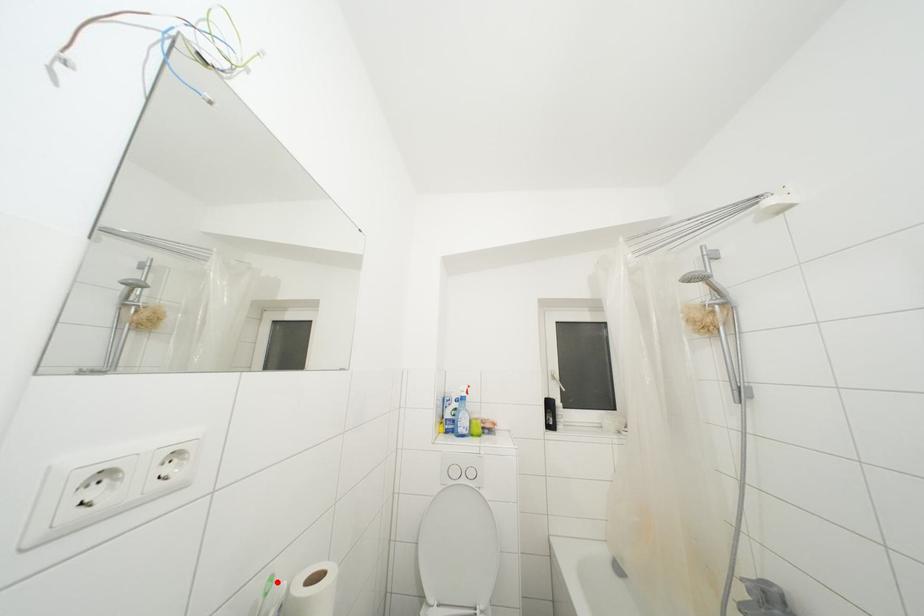
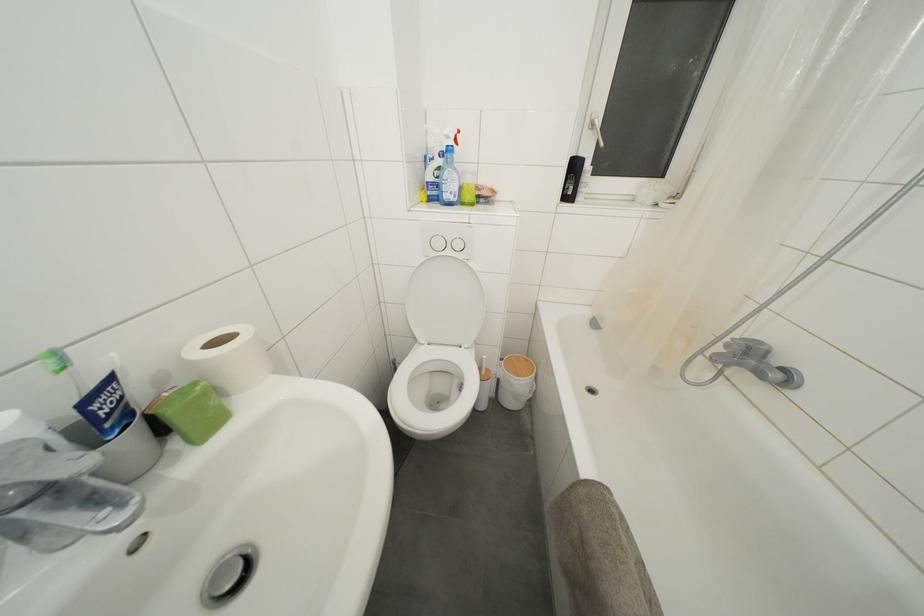
In the second image, find the point that corresponds to the highlighted location in the first image.

(61, 359)